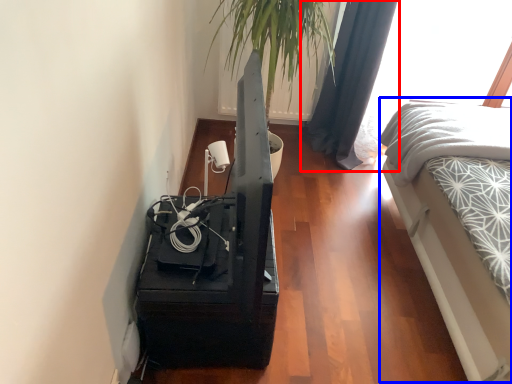
Question: Which object appears closest to the camera in this image, curtain (highlighted by a red box) or bed (highlighted by a blue box)?

Choices:
 (A) curtain
 (B) bed

Answer: (B)